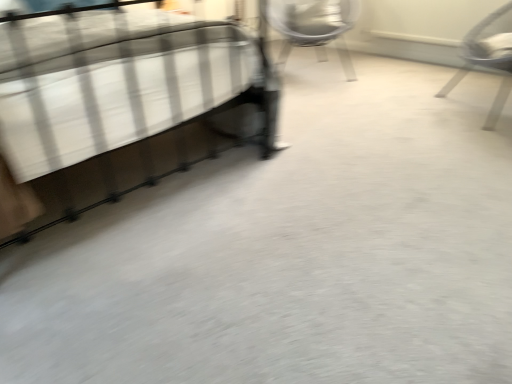
Question: From the image's perspective, relative to metallic silver chair at upper center, marked as the 1th chair in a back-to-front arrangement, is metallic silver chair at right, which appears as the 1th chair when viewed from the right, above or below?

Choices:
 (A) above
 (B) below

Answer: (B)

Question: Which is correct: metallic silver chair at right, arranged as the 1th chair when viewed from the front, is inside metallic silver chair at upper center, which is the 2th chair in front-to-back order, or outside of it?

Choices:
 (A) outside
 (B) inside

Answer: (A)

Question: Based on their relative distances, which object is farther from the metallic silver chair at upper center, which appears as the first chair when viewed from the left?

Choices:
 (A) metallic silver bed at left
 (B) metallic silver chair at right, the 2th chair viewed from the left

Answer: (A)

Question: Which is farther from the metallic silver chair at upper center, the second chair when ordered from right to left?

Choices:
 (A) metallic silver bed at left
 (B) metallic silver chair at right, the 2th chair viewed from the left

Answer: (A)